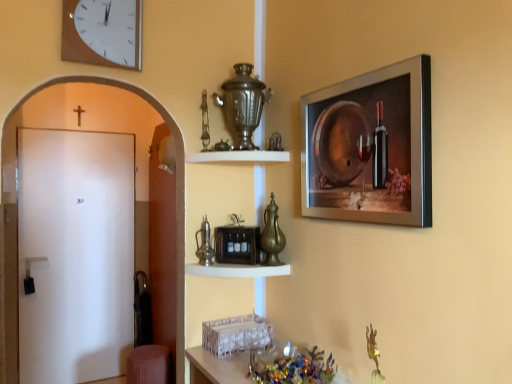
Question: Based on their sizes in the image, would you say silver metallic picture frame at upper right is bigger or smaller than metallic glass bowl at lower center?

Choices:
 (A) big
 (B) small

Answer: (A)

Question: Is silver metallic picture frame at upper right wider or thinner than metallic glass bowl at lower center?

Choices:
 (A) wide
 (B) thin

Answer: (B)

Question: Based on their relative distances, which object is nearer to the metallic black toaster at center, the 2th shelf in the top-to-bottom sequence?

Choices:
 (A) white glossy shelf at upper center, marked as the 2th shelf in a bottom-to-top arrangement
 (B) silver metallic picture frame at upper right
 (C) white matte door at left
 (D) metallic glass bowl at lower center
 (E) gold metallic vase at center

Answer: (E)

Question: Which object is the closest to the white glossy shelf at upper center, marked as the 2th shelf in a bottom-to-top arrangement?

Choices:
 (A) gold metallic vase at center
 (B) silver metallic picture frame at upper right
 (C) white matte door at left
 (D) wooden clock at upper left
 (E) metallic black toaster at center, the 2th shelf in the top-to-bottom sequence

Answer: (A)